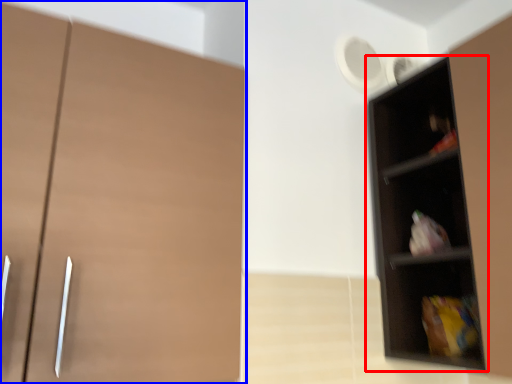
Question: Which of the following is the closest to the observer, shelf (highlighted by a red box) or cupboard (highlighted by a blue box)?

Choices:
 (A) shelf
 (B) cupboard

Answer: (B)